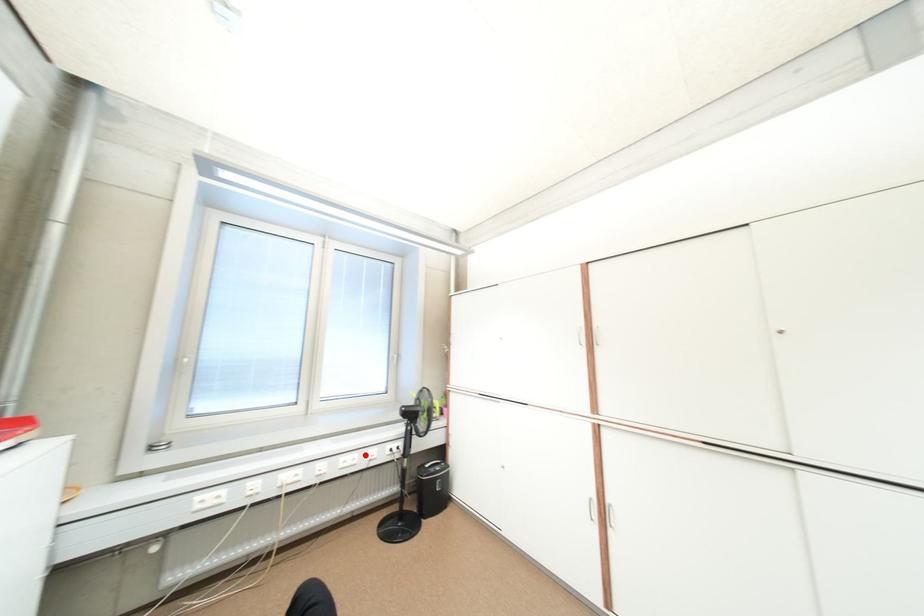
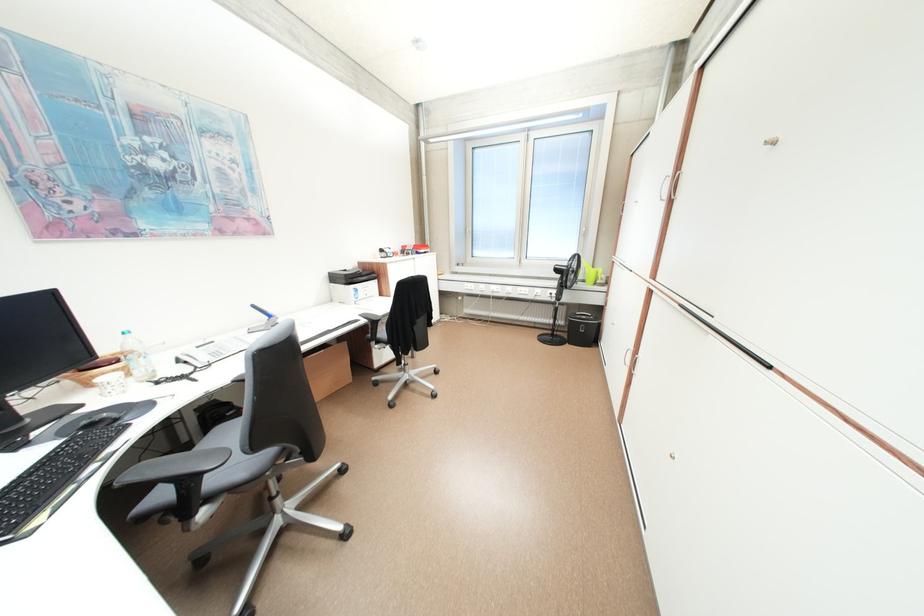
The point at the highlighted location is marked in the first image. Where is the corresponding point in the second image?

(537, 290)